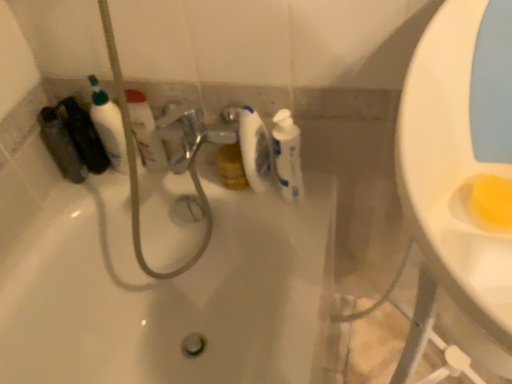
The width and height of the screenshot is (512, 384). Identify the location of vacant area in front of white glossy toilet paper at center. (293, 228).